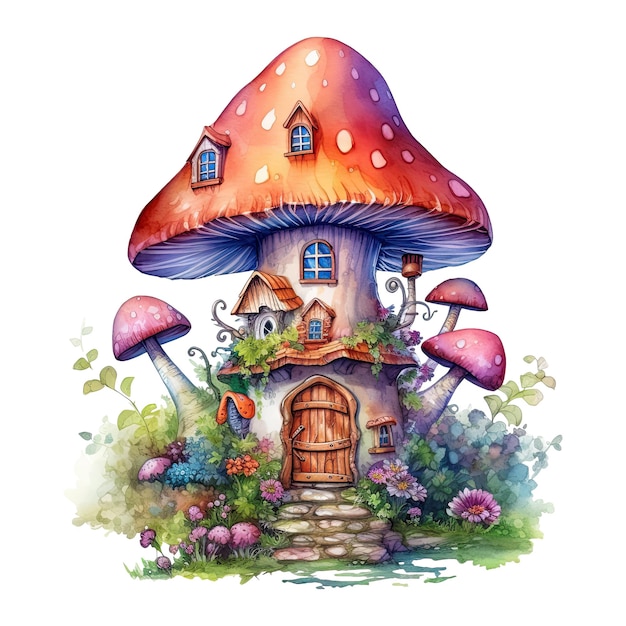
At what (x,y) coordinates should I click in order to perform the action: click on handle. Please return your answer as a coordinate pair (x, y). This screenshot has width=626, height=626. Looking at the image, I should click on (293, 438).